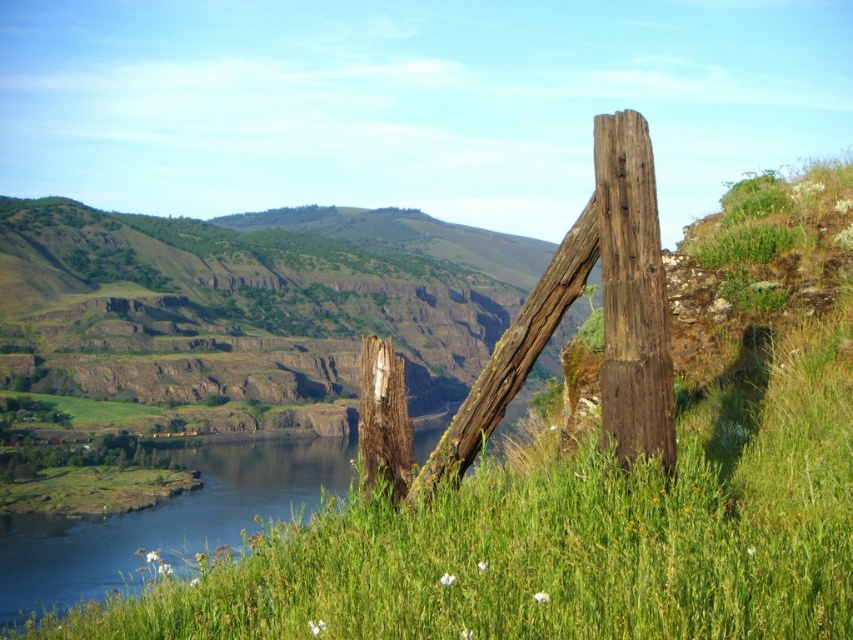
Between green grassy hillside at left and weathered brown wood post at right, which one appears on the right side from the viewer's perspective?

weathered brown wood post at right is more to the right.

What do you see at coordinates (248, 307) in the screenshot? This screenshot has width=853, height=640. I see `green grassy hillside at left` at bounding box center [248, 307].

Where is `green grassy hillside at left`? Image resolution: width=853 pixels, height=640 pixels. green grassy hillside at left is located at coordinates (248, 307).